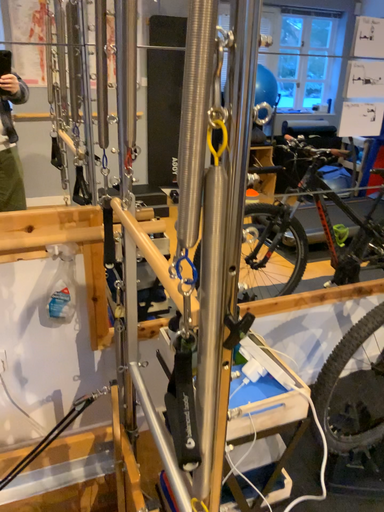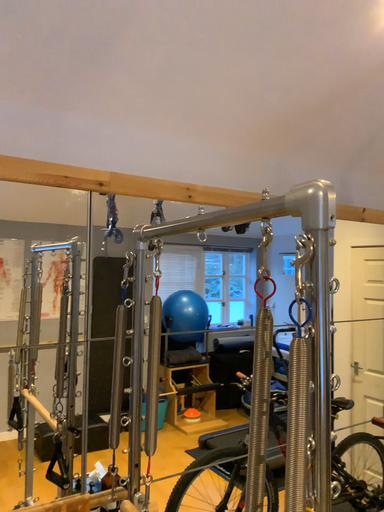
Question: Which way did the camera rotate in the video?

Choices:
 (A) rotated left
 (B) rotated right

Answer: (B)